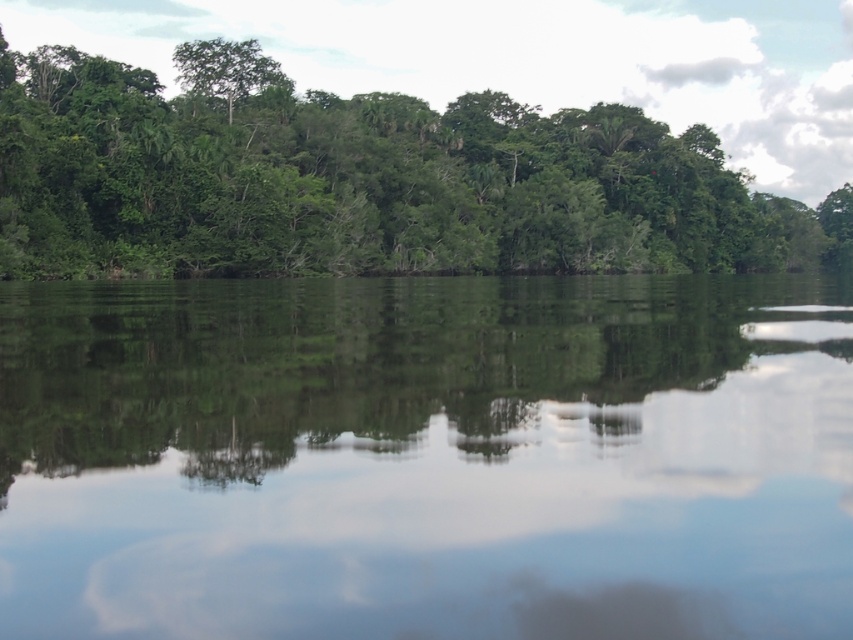
You are standing at the edge of the water and notice the green leafy trees at upper center and the green leafy tree at upper left in the reflection. Which tree is closer to the center of the water surface?

The green leafy trees at upper center is positioned under green leafy tree at upper left, so the green leafy trees at upper center is closer to the center of the water surface.

Based on the photo, you are an artist trying to paint the reflection of the forest in the water. According to the image, where should you place the center of the transparent water at center to accurately depict its position?

The center of the transparent water at center should be placed at the 2D coordinates point (427, 458) to accurately depict its position.

You are a hiker standing at the edge of the forest near the water. You notice two trees in the distance. The first is the green leafy trees at upper center and the second is the green leafy tree at upper left. If you want to walk from one to the other, which direction should you head towards?

The green leafy trees at upper center are 43.00 meters away from the green leafy tree at upper left. To walk from one to the other, you should head in the direction towards the upper left or upper center depending on your starting point, but the distance between them is 43 meters.